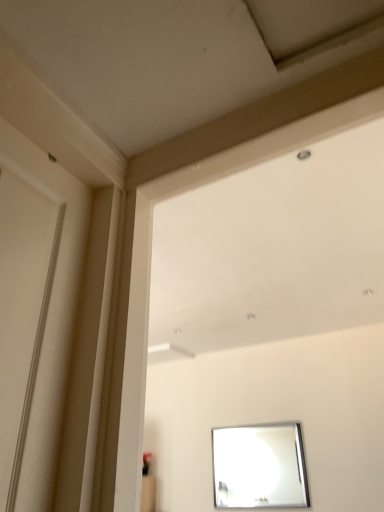
Question: Is white glossy window frame at upper center bigger or smaller than silver metallic mirror at lower center?

Choices:
 (A) big
 (B) small

Answer: (A)

Question: From their relative heights in the image, would you say white glossy window frame at upper center is taller or shorter than silver metallic mirror at lower center?

Choices:
 (A) short
 (B) tall

Answer: (B)

Question: Which is correct: white glossy window frame at upper center is inside silver metallic mirror at lower center, or outside of it?

Choices:
 (A) inside
 (B) outside

Answer: (B)

Question: From the image's perspective, is silver metallic mirror at lower center located above or below white glossy window frame at upper center?

Choices:
 (A) below
 (B) above

Answer: (A)

Question: From a real-world perspective, relative to white glossy window frame at upper center, is silver metallic mirror at lower center vertically above or below?

Choices:
 (A) below
 (B) above

Answer: (A)

Question: Relative to white glossy window frame at upper center, is silver metallic mirror at lower center in front or behind?

Choices:
 (A) front
 (B) behind

Answer: (B)

Question: Considering the relative positions of silver metallic mirror at lower center and white glossy window frame at upper center in the image provided, is silver metallic mirror at lower center to the left or to the right of white glossy window frame at upper center?

Choices:
 (A) right
 (B) left

Answer: (A)